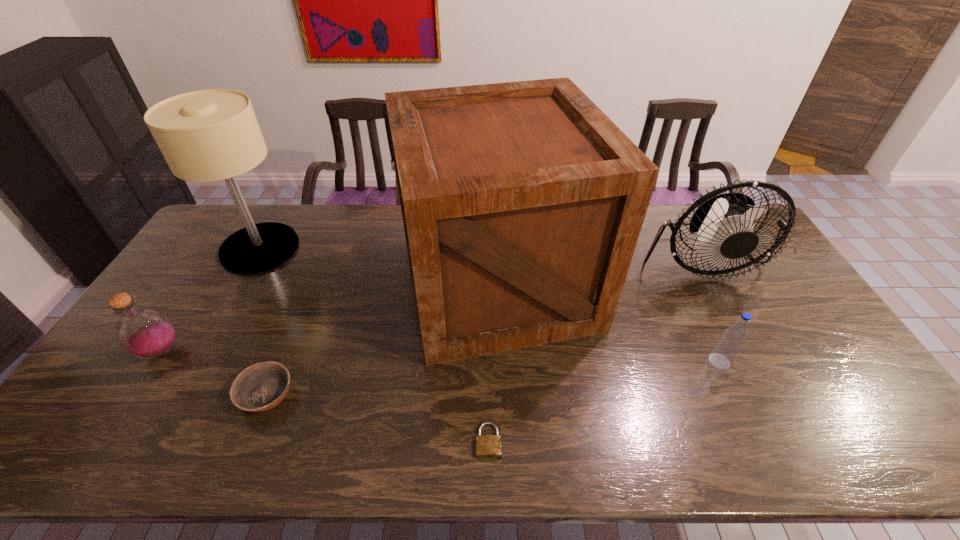
Locate an element on the screen. box is located at coordinates (522, 202).

This screenshot has height=540, width=960. I want to click on table lamp, so click(208, 135).

Identify the location of fan. The height and width of the screenshot is (540, 960). (721, 228).

Find the location of a particular element. Image resolution: width=960 pixels, height=540 pixels. bottle is located at coordinates (145, 333).

Find the location of `water bottle`. water bottle is located at coordinates (728, 346).

Locate an element on the screen. the fifth object from right to left is located at coordinates (262, 386).

Where is `the sixth farthest object`? The height and width of the screenshot is (540, 960). the sixth farthest object is located at coordinates [x=262, y=386].

Locate an element on the screen. padlock is located at coordinates (487, 446).

The image size is (960, 540). I want to click on the nearest object, so click(x=487, y=446).

Where is `free point located on the front of the box`? The image size is (960, 540). free point located on the front of the box is located at coordinates (502, 395).